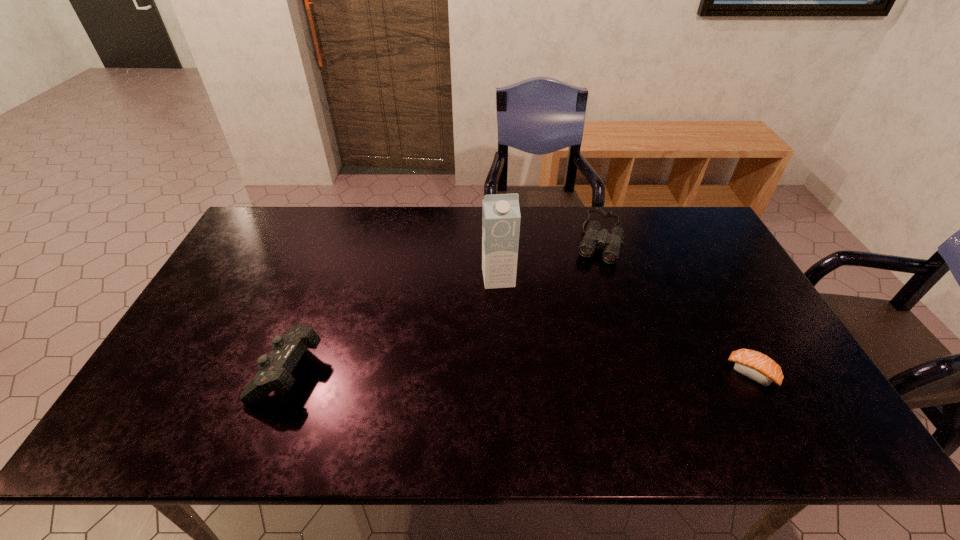
Identify the location of object at the near right corner. (752, 364).

The width and height of the screenshot is (960, 540). In the image, there is a desktop. What are the coordinates of `free space at the far edge` in the screenshot? It's located at (663, 246).

Image resolution: width=960 pixels, height=540 pixels. What are the coordinates of `vacant space at the near edge` in the screenshot? It's located at (269, 403).

You are a GUI agent. You are given a task and a screenshot of the screen. Output one action in this format:
    pyautogui.click(x=<x>, y=<y>)
    Task: Click on the vacant space at the right edge
    Image resolution: width=960 pixels, height=540 pixels.
    Given the screenshot: What is the action you would take?
    pyautogui.click(x=683, y=267)

Where is `free spot at the far left corner of the desktop`? free spot at the far left corner of the desktop is located at coordinates (269, 228).

What are the coordinates of `vacant region at the near left corner of the desktop` in the screenshot? It's located at (182, 388).

Where is `vacant region between the third shortest object and the farthest object`? vacant region between the third shortest object and the farthest object is located at coordinates (444, 302).

This screenshot has height=540, width=960. In order to click on vacant space that is in between the third shortest object and the tallest object in this screenshot , I will do `click(394, 323)`.

The height and width of the screenshot is (540, 960). I want to click on free space between the shortest object and the third object from right to left, so click(625, 326).

You are a GUI agent. You are given a task and a screenshot of the screen. Output one action in this format:
    pyautogui.click(x=<x>, y=<y>)
    Task: Click on the vacant region between the sushi and the farthest object
    
    Given the screenshot: What is the action you would take?
    pyautogui.click(x=675, y=305)